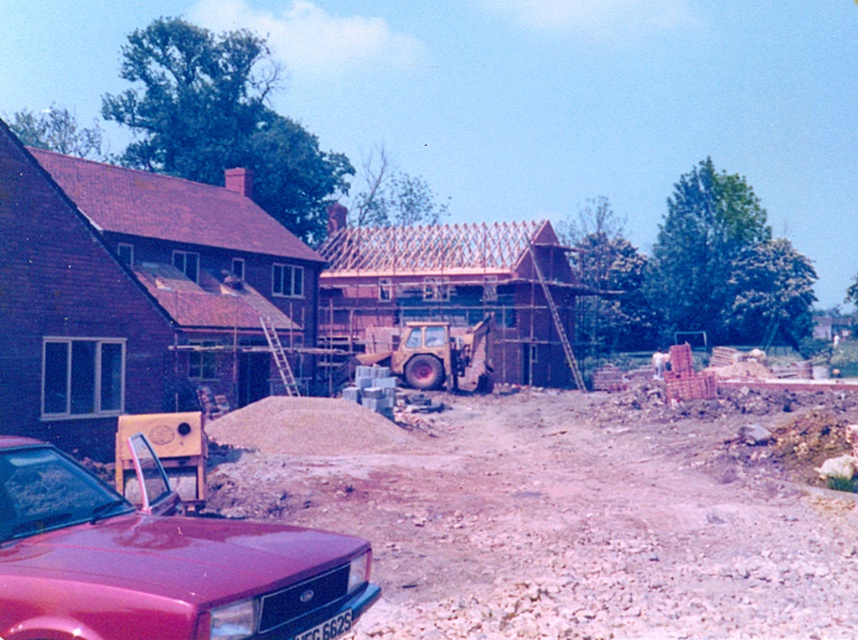
Is brown gravel at center thinner than yellow rubber excavator at center?

No, brown gravel at center is not thinner than yellow rubber excavator at center.

Does point (311, 509) come in front of point (467, 348)?

Yes, it is.

You are a GUI agent. You are given a task and a screenshot of the screen. Output one action in this format:
    pyautogui.click(x=<x>, y=<y>)
    Task: Click on the brown gravel at center
    The width and height of the screenshot is (858, 640).
    Given the screenshot: What is the action you would take?
    pyautogui.click(x=557, y=513)

Is point (179, 548) farther from camera compared to point (462, 369)?

No, it is in front of (462, 369).

What do you see at coordinates (158, 564) in the screenshot? This screenshot has width=858, height=640. I see `shiny red car at lower left` at bounding box center [158, 564].

Locate an element on the screen. This screenshot has width=858, height=640. shiny red car at lower left is located at coordinates (158, 564).

Who is higher up, brown gravel at center or shiny red car at lower left?

shiny red car at lower left is above.

Does brown gravel at center lie behind shiny red car at lower left?

Yes, it is behind shiny red car at lower left.

Locate an element on the screen. This screenshot has width=858, height=640. brown gravel at center is located at coordinates (557, 513).